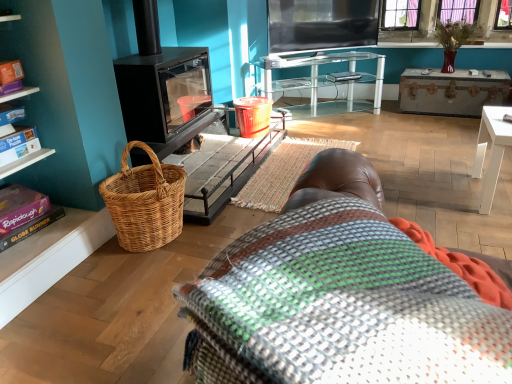
Find the location of a particular element. The image size is (512, 384). vacant space behind white glossy table at lower right, the 1th table when ordered from bottom to top is located at coordinates (454, 173).